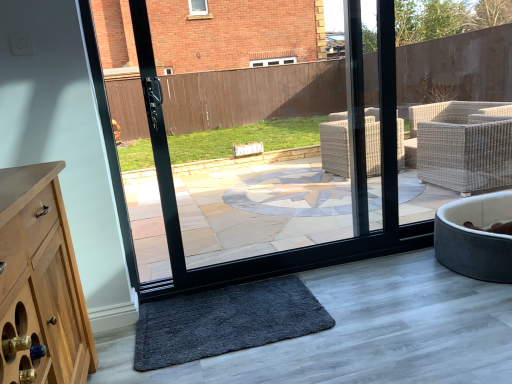
Question: From their relative heights in the image, would you say dark gray shaggy mat at lower center is taller or shorter than velvet grey pet bed at lower right?

Choices:
 (A) short
 (B) tall

Answer: (A)

Question: From the image's perspective, relative to velvet grey pet bed at lower right, is dark gray shaggy mat at lower center above or below?

Choices:
 (A) above
 (B) below

Answer: (B)

Question: Considering their positions, is dark gray shaggy mat at lower center located in front of or behind velvet grey pet bed at lower right?

Choices:
 (A) behind
 (B) front

Answer: (B)

Question: Is velvet grey pet bed at lower right wider or thinner than dark gray shaggy mat at lower center?

Choices:
 (A) thin
 (B) wide

Answer: (B)

Question: Is velvet grey pet bed at lower right spatially inside dark gray shaggy mat at lower center, or outside of it?

Choices:
 (A) outside
 (B) inside

Answer: (A)

Question: Would you say velvet grey pet bed at lower right is to the left or to the right of dark gray shaggy mat at lower center in the picture?

Choices:
 (A) left
 (B) right

Answer: (B)

Question: From a real-world perspective, is velvet grey pet bed at lower right above or below dark gray shaggy mat at lower center?

Choices:
 (A) below
 (B) above

Answer: (B)